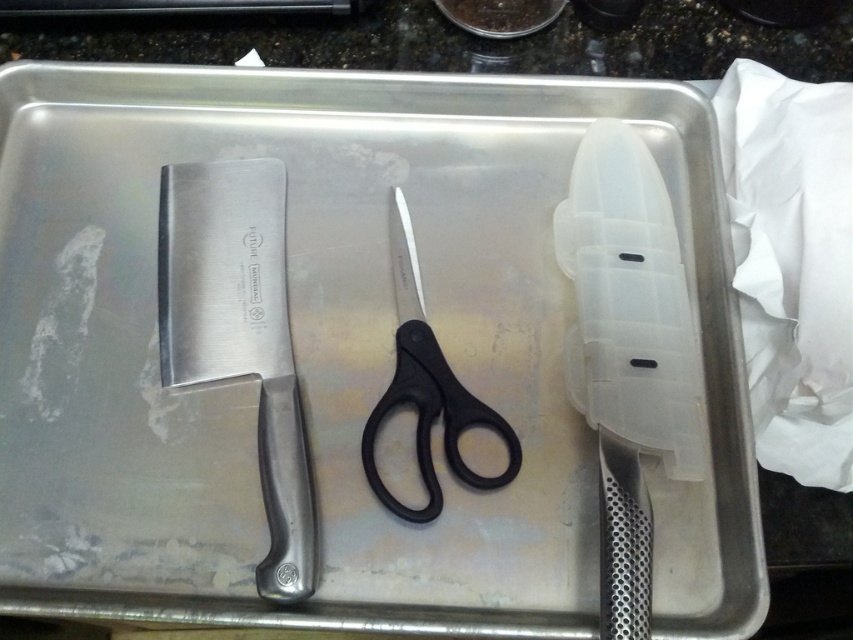
Question: Which of the following is the closest to the observer?

Choices:
 (A) (625, 432)
 (B) (405, 285)
 (C) (292, 492)

Answer: (C)

Question: Is transparent plastic razor at center positioned before black plastic scissors at center?

Choices:
 (A) yes
 (B) no

Answer: (A)

Question: Observing the image, what is the correct spatial positioning of polished metal knife at left in reference to black plastic scissors at center?

Choices:
 (A) above
 (B) below

Answer: (B)

Question: Which object is the farthest from the transparent plastic razor at center?

Choices:
 (A) polished metal knife at left
 (B) black plastic scissors at center

Answer: (A)

Question: Is transparent plastic razor at center positioned at the back of black plastic scissors at center?

Choices:
 (A) yes
 (B) no

Answer: (B)

Question: Which of the following is the farthest from the observer?

Choices:
 (A) black plastic scissors at center
 (B) polished metal knife at left
 (C) transparent plastic razor at center

Answer: (A)